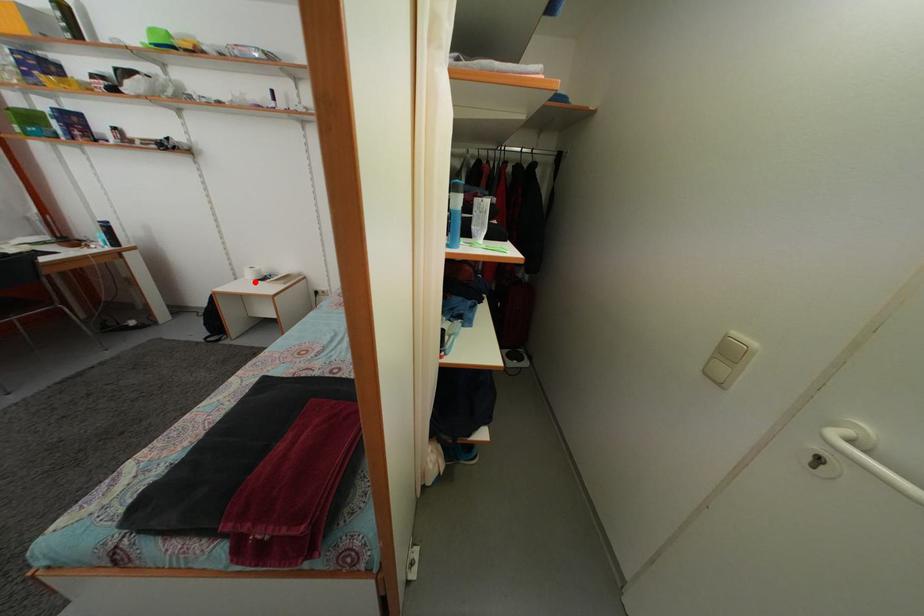
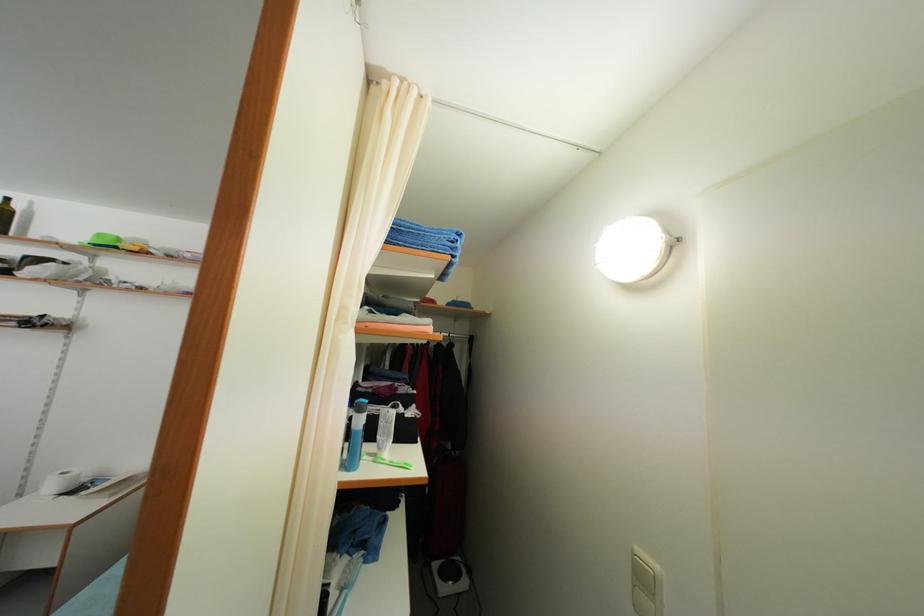
Question: I am providing you with two images of the same scene from different viewpoints. In image1, a red point is highlighted. Considering the same 3D point in image2, which of the following is correct?

Choices:
 (A) It is closer
 (B) It is farther

Answer: (A)